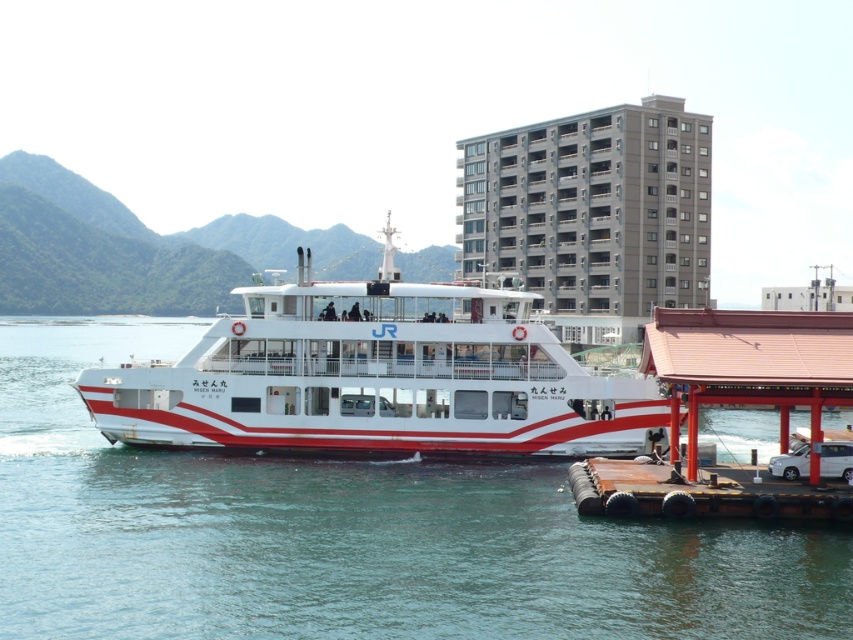
Question: Is white water at center further to the viewer compared to white glossy ferry at center?

Choices:
 (A) yes
 (B) no

Answer: (B)

Question: Where is white water at center located in relation to white glossy ferry at center in the image?

Choices:
 (A) left
 (B) right

Answer: (A)

Question: Which of the following is the closest to the observer?

Choices:
 (A) (701, 554)
 (B) (387, 268)

Answer: (A)

Question: Which point is closer to the camera?

Choices:
 (A) pyautogui.click(x=494, y=356)
 (B) pyautogui.click(x=183, y=324)

Answer: (A)

Question: Does white water at center come behind white glossy ferry at center?

Choices:
 (A) no
 (B) yes

Answer: (A)